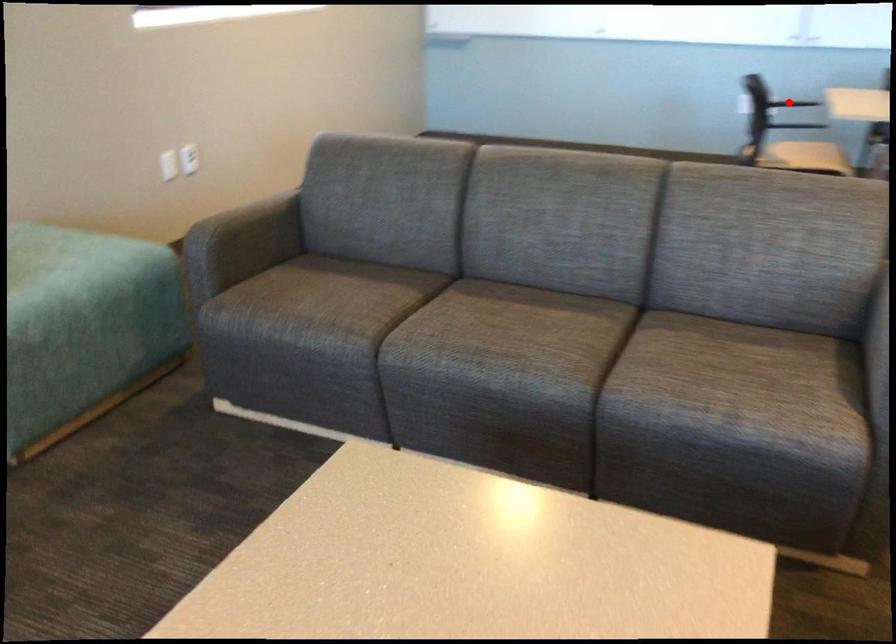
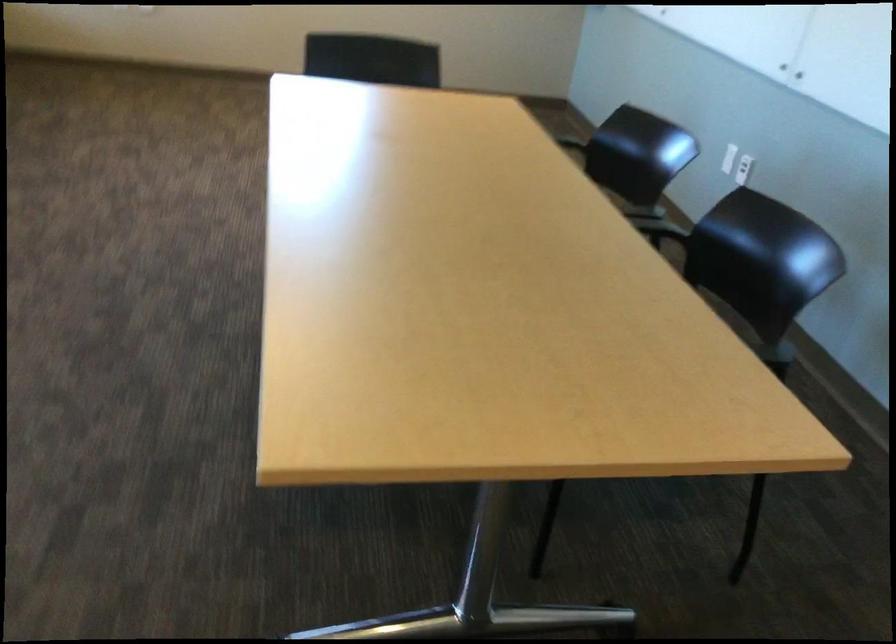
Question: I am providing you with two images of the same scene from different viewpoints. A red point is marked on the first image. At the location where the point appears in image 1, is it still visible in image 2?

Choices:
 (A) Yes
 (B) No

Answer: (B)